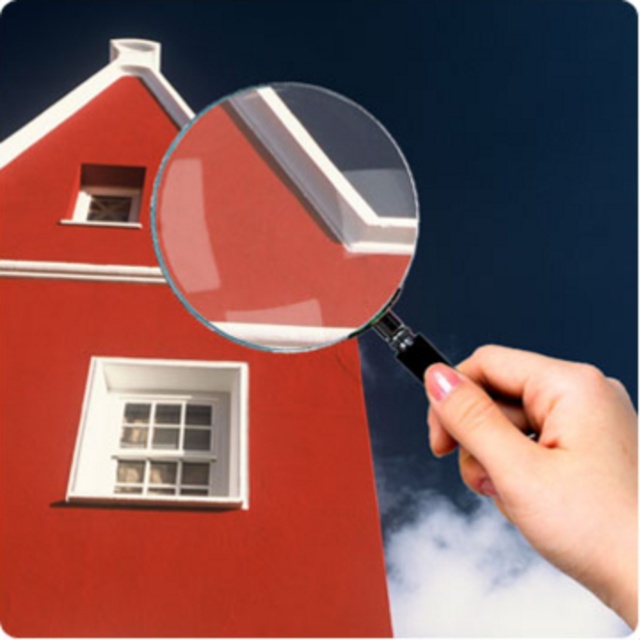
Between transparent plastic magnifying glass at upper center and pink polished fingernails at upper right, which one appears on the right side from the viewer's perspective?

From the viewer's perspective, pink polished fingernails at upper right appears more on the right side.

Based on the photo, is transparent plastic magnifying glass at upper center further to the viewer compared to pink polished fingernails at upper right?

Yes, it is behind pink polished fingernails at upper right.

Which is in front, point (272, 301) or point (552, 564)?

Point (552, 564)

Where is `transparent plastic magnifying glass at upper center`? The width and height of the screenshot is (640, 640). transparent plastic magnifying glass at upper center is located at coordinates (284, 216).